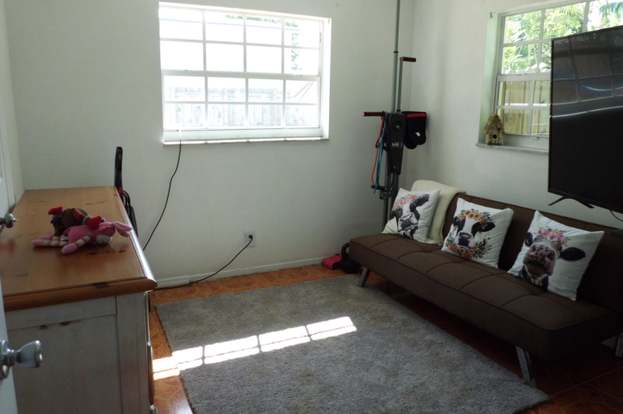
Find the location of a particular element. This screenshot has height=414, width=623. paned windows is located at coordinates (225, 77), (521, 82).